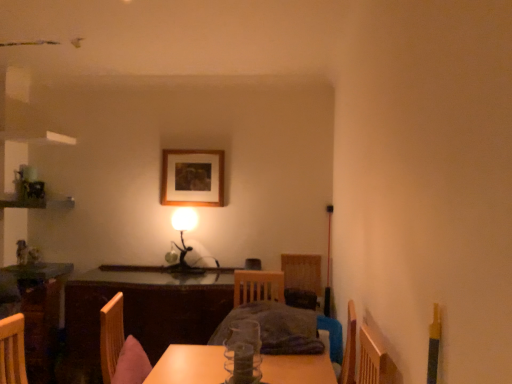
Question: From the image's perspective, is wooden table at center above or below wooden picture frame at center?

Choices:
 (A) above
 (B) below

Answer: (B)

Question: Considering the positions of point tap(161, 311) and point tap(192, 182), is point tap(161, 311) closer or farther from the camera than point tap(192, 182)?

Choices:
 (A) farther
 (B) closer

Answer: (B)

Question: Which object is positioned farthest from the wooden table at center?

Choices:
 (A) clear glass vase at center
 (B) matte black table lamp at center
 (C) wooden picture frame at center

Answer: (A)

Question: Based on their relative distances, which object is farther from the matte black table lamp at center?

Choices:
 (A) wooden picture frame at center
 (B) wooden table at center
 (C) clear glass vase at center

Answer: (C)